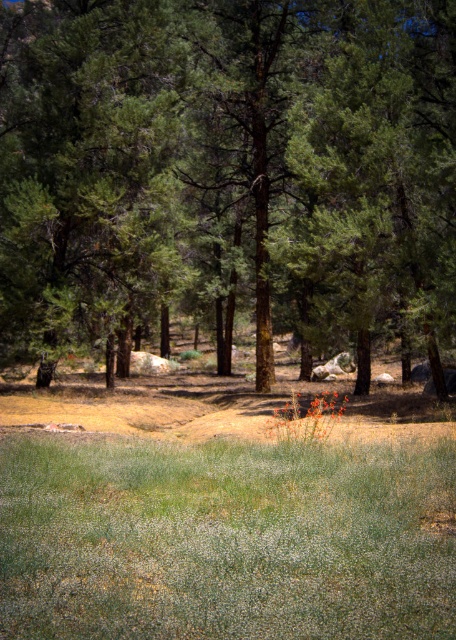
You are standing in the forest and see the green textured tree at center and the green soft grass at lower center. Which object is located higher up in the image?

The green textured tree at center is positioned over the green soft grass at lower center, so it is higher up in the image.

You are a hiker carrying a backpack and need to set up a tent. You have two options for the tent location. One is near the green textured tree at center and the other is near the green soft grass at lower center. Based on the space available, which location would provide more room for your tent?

The green textured tree at center might be wider than green soft grass at lower center, so the area near the green textured tree at center likely offers more space for setting up the tent since it could have a broader clearing.

You are standing at the origin point in the forest scene. The green textured tree at center is marked at coordinates 0.270, 0.500. If you want to walk directly towards the tree, which direction should you head in?

The green textured tree at center is located at coordinates (x=228, y=172). Since the x coordinate is 0.270, which is to the right of the origin, you should head towards the right to reach the tree.